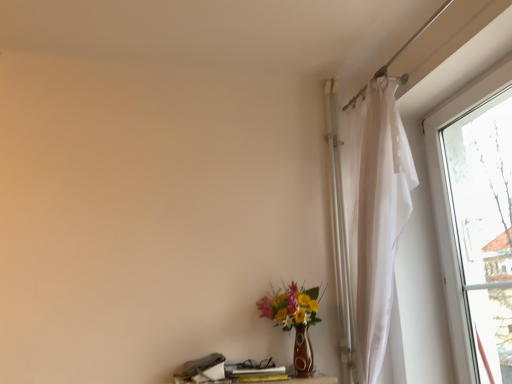
Find the location of a particular element. wooden table at lower center is located at coordinates (268, 380).

Measure the distance between point (324, 381) and camera.

They are 1.86 meters apart.

Image resolution: width=512 pixels, height=384 pixels. Describe the element at coordinates (268, 380) in the screenshot. I see `wooden table at lower center` at that location.

In order to click on matte brown vase at lower center in this screenshot , I will do `click(294, 321)`.

In order to face matte brown vase at lower center, should I rotate leftwards or rightwards?

It's best to rotate right around 5.039 degrees.

This screenshot has height=384, width=512. Describe the element at coordinates (294, 321) in the screenshot. I see `matte brown vase at lower center` at that location.

This screenshot has width=512, height=384. What are the coordinates of `wooden table at lower center` in the screenshot? It's located at (268, 380).

Considering the positions of objects wooden table at lower center and matte brown vase at lower center in the image provided, who is more to the left, wooden table at lower center or matte brown vase at lower center?

Positioned to the left is wooden table at lower center.

Is wooden table at lower center positioned behind matte brown vase at lower center?

No, wooden table at lower center is in front of matte brown vase at lower center.

Does point (298, 383) appear closer or farther from the camera than point (311, 307)?

Point (298, 383) is positioned farther from the camera compared to point (311, 307).

From the image's perspective, between wooden table at lower center and matte brown vase at lower center, which one is located above?

From the image's view, matte brown vase at lower center is above.

From a real-world perspective, which is physically above, wooden table at lower center or matte brown vase at lower center?

matte brown vase at lower center, from a real-world perspective.

Considering the sizes of objects wooden table at lower center and matte brown vase at lower center in the image provided, who is wider, wooden table at lower center or matte brown vase at lower center?

With larger width is matte brown vase at lower center.

Who is taller, wooden table at lower center or matte brown vase at lower center?

matte brown vase at lower center is taller.

Considering the sizes of wooden table at lower center and matte brown vase at lower center in the image, is wooden table at lower center bigger or smaller than matte brown vase at lower center?

wooden table at lower center is smaller than matte brown vase at lower center.

Would you say wooden table at lower center contains matte brown vase at lower center?

That's incorrect, matte brown vase at lower center is not inside wooden table at lower center.

From the picture: Is wooden table at lower center placed right next to matte brown vase at lower center?

No, wooden table at lower center is not in contact with matte brown vase at lower center.

Is wooden table at lower center oriented away from matte brown vase at lower center?

No.

Can you tell me how much wooden table at lower center and matte brown vase at lower center differ in facing direction?

The facing directions of wooden table at lower center and matte brown vase at lower center are 0.84 degrees apart.

I want to click on table in front of the matte brown vase at lower center, so click(x=268, y=380).

Considering the positions of objects matte brown vase at lower center and wooden table at lower center in the image provided, who is more to the right, matte brown vase at lower center or wooden table at lower center?

Positioned to the right is matte brown vase at lower center.

Between matte brown vase at lower center and wooden table at lower center, which one is positioned behind?

matte brown vase at lower center is more distant.

Considering the positions of point (298, 345) and point (183, 380), is point (298, 345) closer or farther from the camera than point (183, 380)?

Clearly, point (298, 345) is more distant from the camera than point (183, 380).

From the image's perspective, who appears lower, matte brown vase at lower center or wooden table at lower center?

wooden table at lower center is shown below in the image.

From a real-world perspective, relative to wooden table at lower center, is matte brown vase at lower center vertically above or below?

In terms of real-world spatial position, matte brown vase at lower center is above wooden table at lower center.

Can you confirm if matte brown vase at lower center is thinner than wooden table at lower center?

No.

Considering the sizes of objects matte brown vase at lower center and wooden table at lower center in the image provided, who is shorter, matte brown vase at lower center or wooden table at lower center?

wooden table at lower center.

Considering the relative sizes of matte brown vase at lower center and wooden table at lower center in the image provided, is matte brown vase at lower center bigger than wooden table at lower center?

Yes, matte brown vase at lower center is bigger than wooden table at lower center.

Is matte brown vase at lower center not within wooden table at lower center?

Yes, matte brown vase at lower center is outside of wooden table at lower center.

Is matte brown vase at lower center far from wooden table at lower center?

They are positioned close to each other.

Is matte brown vase at lower center turned away from wooden table at lower center?

matte brown vase at lower center is not turned away from wooden table at lower center.

Measure the distance from matte brown vase at lower center to wooden table at lower center.

A distance of 22.34 centimeters exists between matte brown vase at lower center and wooden table at lower center.

The height and width of the screenshot is (384, 512). In order to click on houseplant above the wooden table at lower center (from a real-world perspective) in this screenshot , I will do `click(294, 321)`.

Identify the location of table lying on the left of matte brown vase at lower center. Image resolution: width=512 pixels, height=384 pixels. (268, 380).

Find the location of a particular element. This screenshot has height=384, width=512. houseplant lying behind the wooden table at lower center is located at coordinates (294, 321).